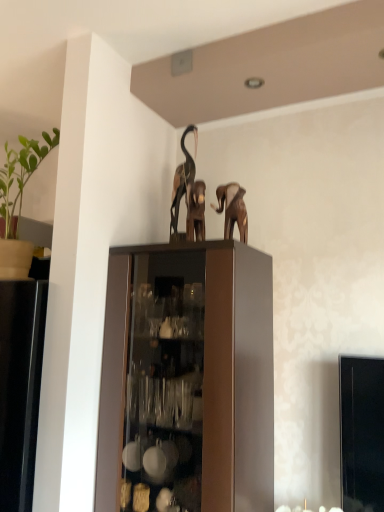
Question: From the image's perspective, would you say green matte plant at left is shown under brown matte elephant at upper center?

Choices:
 (A) no
 (B) yes

Answer: (A)

Question: Can you confirm if green matte plant at left is bigger than brown matte elephant at upper center?

Choices:
 (A) yes
 (B) no

Answer: (A)

Question: Is green matte plant at left closer to the viewer compared to brown matte elephant at upper center?

Choices:
 (A) yes
 (B) no

Answer: (A)

Question: Is green matte plant at left smaller than brown matte elephant at upper center?

Choices:
 (A) no
 (B) yes

Answer: (A)

Question: Can brown matte elephant at upper center be found inside green matte plant at left?

Choices:
 (A) yes
 (B) no

Answer: (B)

Question: Considering the positions of wooden elephant at center, which is the first animal in front-to-back order, and green matte plant at left in the image, is wooden elephant at center, which is the first animal in front-to-back order, bigger or smaller than green matte plant at left?

Choices:
 (A) big
 (B) small

Answer: (B)

Question: Is wooden elephant at center, which is the first animal in front-to-back order, wider or thinner than green matte plant at left?

Choices:
 (A) wide
 (B) thin

Answer: (B)

Question: Is point (188, 188) positioned closer to the camera than point (0, 267)?

Choices:
 (A) closer
 (B) farther

Answer: (B)

Question: In the image, is wooden elephant at center, which is the first animal in front-to-back order, on the left side or the right side of green matte plant at left?

Choices:
 (A) left
 (B) right

Answer: (B)

Question: Based on their sizes in the image, would you say metallic brown elephant at upper center, which is the 1th animal in back-to-front order, is bigger or smaller than green matte plant at left?

Choices:
 (A) big
 (B) small

Answer: (B)

Question: Considering the positions of metallic brown elephant at upper center, which is the 1th animal in back-to-front order, and green matte plant at left in the image, is metallic brown elephant at upper center, which is the 1th animal in back-to-front order, wider or thinner than green matte plant at left?

Choices:
 (A) wide
 (B) thin

Answer: (B)

Question: Considering the relative positions of metallic brown elephant at upper center, which is the 1th animal in back-to-front order, and green matte plant at left in the image provided, is metallic brown elephant at upper center, which is the 1th animal in back-to-front order, to the left or to the right of green matte plant at left?

Choices:
 (A) left
 (B) right

Answer: (B)

Question: From a real-world perspective, is metallic brown elephant at upper center, marked as the second animal in a front-to-back arrangement, positioned above or below green matte plant at left?

Choices:
 (A) below
 (B) above

Answer: (B)

Question: Is wooden elephant at center, which is the first animal in front-to-back order, wider or thinner than metallic brown elephant at upper center, which is the 1th animal in back-to-front order?

Choices:
 (A) thin
 (B) wide

Answer: (A)

Question: Considering the positions of point (193, 215) and point (200, 221), is point (193, 215) closer or farther from the camera than point (200, 221)?

Choices:
 (A) closer
 (B) farther

Answer: (B)